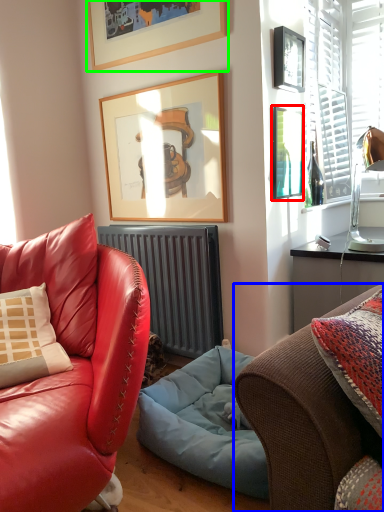
Question: Which is farther away from picture frame (highlighted by a red box)? studio couch (highlighted by a blue box) or picture frame (highlighted by a green box)?

Choices:
 (A) studio couch
 (B) picture frame

Answer: (A)